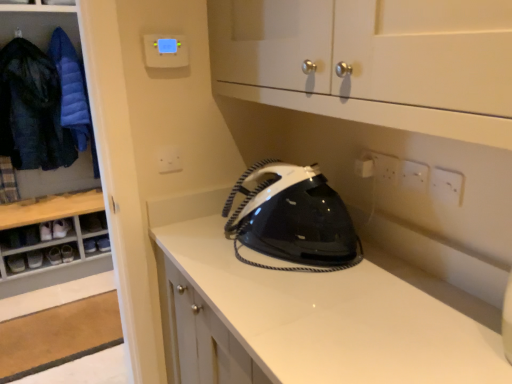
In order to face white plastic electric outlet at center, which is counted as the 3th electric outlet, starting from the right, should I rotate leftwards or rightwards?

To align with it, rotate left about 11.544°.

Image resolution: width=512 pixels, height=384 pixels. I want to click on white plastic electric outlet at center, which is counted as the 3th electric outlet, starting from the right, so click(x=169, y=159).

What do you see at coordinates (293, 219) in the screenshot?
I see `black glossy iron at center` at bounding box center [293, 219].

You are a GUI agent. You are given a task and a screenshot of the screen. Output one action in this format:
    pyautogui.click(x=<x>, y=<y>)
    Task: Click on the white fabric shoe at lower left, the 1th footwear when ordered from top to bottom
    Image resolution: width=512 pixels, height=384 pixels.
    Given the screenshot: What is the action you would take?
    pyautogui.click(x=60, y=228)

Is white plastic electric outlet at upper right, the 2th electric outlet viewed from the left, taller or shorter than white leather shoe at lower left, the 4th footwear in the top-to-bottom sequence?

Considering their sizes, white plastic electric outlet at upper right, the 2th electric outlet viewed from the left, has more height than white leather shoe at lower left, the 4th footwear in the top-to-bottom sequence.

Does white plastic electric outlet at upper right, the second electric outlet viewed from the front, come in front of white leather shoe at lower left, the 4th footwear in the top-to-bottom sequence?

Yes, the depth of white plastic electric outlet at upper right, the second electric outlet viewed from the front, is less than that of white leather shoe at lower left, the 4th footwear in the top-to-bottom sequence.

Looking at this image, can you confirm if white plastic electric outlet at upper right, which is counted as the second electric outlet, starting from the back, is positioned to the left of white leather shoe at lower left, the 4th footwear in the top-to-bottom sequence?

No.

Identify the location of the 4th footwear to the left of the white plastic electric outlet at center, the first electric outlet from the left, starting your count from the anchor. The image size is (512, 384). (34, 259).

Could you tell me if white leather shoe at lower left, the 4th footwear in the top-to-bottom sequence, is turned towards white plastic electric outlet at center, which is counted as the 1th electric outlet, starting from the back?

No, white leather shoe at lower left, the 4th footwear in the top-to-bottom sequence, is not facing towards white plastic electric outlet at center, which is counted as the 1th electric outlet, starting from the back.

Can you confirm if white leather shoe at lower left, arranged as the 2th footwear when ordered from the bottom, is positioned to the right of white plastic electric outlet at center, placed as the third electric outlet when sorted from front to back?

In fact, white leather shoe at lower left, arranged as the 2th footwear when ordered from the bottom, is to the left of white plastic electric outlet at center, placed as the third electric outlet when sorted from front to back.

Is white leather shoe at lower left, arranged as the 2th footwear when ordered from the bottom, positioned behind white plastic electric outlet at center, placed as the third electric outlet when sorted from front to back?

Yes.

How different are the orientations of black glossy iron at center and dark blue quilted jacket at left, the 2th clothing from the right, in degrees?

They differ by 90.8 degrees in their facing directions.

Looking at the image, does black glossy iron at center seem bigger or smaller compared to dark blue quilted jacket at left, the 2th clothing from the right?

black glossy iron at center is smaller than dark blue quilted jacket at left, the 2th clothing from the right.

From a real-world perspective, who is located higher, black glossy iron at center or dark blue quilted jacket at left, the first clothing in the left-to-right sequence?

dark blue quilted jacket at left, the first clothing in the left-to-right sequence, is physically above.

Does black glossy iron at center appear on the right side of dark blue quilted jacket at left, the first clothing in the left-to-right sequence?

Yes, black glossy iron at center is to the right of dark blue quilted jacket at left, the first clothing in the left-to-right sequence.

Is white plastic electric outlet at upper right, which is the second electric outlet from right to left, smaller than blue down jacket at left, which appears as the first clothing when viewed from the right?

Indeed, white plastic electric outlet at upper right, which is the second electric outlet from right to left, has a smaller size compared to blue down jacket at left, which appears as the first clothing when viewed from the right.

From the image's perspective, is white plastic electric outlet at upper right, the 2th electric outlet viewed from the left, beneath blue down jacket at left, which appears as the first clothing when viewed from the right?

Yes.

Who is more distant, white plastic electric outlet at upper right, the second electric outlet viewed from the front, or blue down jacket at left, positioned as the second clothing in left-to-right order?

blue down jacket at left, positioned as the second clothing in left-to-right order, is further from the camera.

From the image's perspective, would you say black leather shoe at lower left, the 1th footwear ordered from the bottom, is shown under dark blue quilted jacket at left, the 2th clothing from the right?

Indeed, from the image's perspective, black leather shoe at lower left, the 1th footwear ordered from the bottom, is shown beneath dark blue quilted jacket at left, the 2th clothing from the right.

From a real-world perspective, between black leather shoe at lower left, the 1th footwear ordered from the bottom, and dark blue quilted jacket at left, the 2th clothing from the right, who is vertically lower?

In real-world perspective, black leather shoe at lower left, the 1th footwear ordered from the bottom, is lower.

Considering the positions of point (22, 269) and point (29, 79), is point (22, 269) closer or farther from the camera than point (29, 79)?

Clearly, point (22, 269) is more distant from the camera than point (29, 79).

Are black leather shoe at lower left, the 1th footwear ordered from the bottom, and dark blue quilted jacket at left, the first clothing in the left-to-right sequence, located far from each other?

No, black leather shoe at lower left, the 1th footwear ordered from the bottom, is in close proximity to dark blue quilted jacket at left, the first clothing in the left-to-right sequence.

How far apart are black leather shoe at lower left, the 1th footwear ordered from the bottom, and black leather shoe at lower left, marked as the 3th footwear in a bottom-to-top arrangement?

A distance of 17.98 centimeters exists between black leather shoe at lower left, the 1th footwear ordered from the bottom, and black leather shoe at lower left, marked as the 3th footwear in a bottom-to-top arrangement.

There is a black leather shoe at lower left, marked as the 3th footwear in a bottom-to-top arrangement. Where is `the 2nd footwear below it (from a real-world perspective)`? The image size is (512, 384). the 2nd footwear below it (from a real-world perspective) is located at coordinates (16, 263).

How different are the orientations of black leather shoe at lower left, the 1th footwear ordered from the bottom, and black leather shoe at lower left, marked as the 3th footwear in a bottom-to-top arrangement, in degrees?

0.000269 degrees.

Is point (17, 264) closer to viewer compared to point (60, 259)?

Yes, it is.

Is point (58, 237) in front of point (24, 107)?

No, it is behind (24, 107).

Is white fabric shoe at lower left, the 1th footwear when ordered from top to bottom, with dark blue quilted jacket at left, the 2th clothing from the right?

No, white fabric shoe at lower left, the 1th footwear when ordered from top to bottom, is not making contact with dark blue quilted jacket at left, the 2th clothing from the right.

From a real-world perspective, which object rests below the other?

In real-world perspective, white fabric shoe at lower left, which is the 5th footwear in bottom-to-top order, is lower.

From the image's perspective, between white fabric shoe at lower left, the 1th footwear when ordered from top to bottom, and dark blue quilted jacket at left, the first clothing in the left-to-right sequence, which one is located above?

dark blue quilted jacket at left, the first clothing in the left-to-right sequence.

Identify the location of the 2nd electric outlet above the white leather shoe at lower left, the 4th footwear in the top-to-bottom sequence (from the image's perspective). (413, 176).

The height and width of the screenshot is (384, 512). Identify the location of the 4th footwear behind the white plastic electric outlet at center, placed as the third electric outlet when sorted from front to back, starting your count from the anchor. (34, 259).

When comparing their distances from white fabric shoe at lower left, the 1th footwear when ordered from top to bottom, does dark blue quilted jacket at left, the 2th clothing from the right, or white plastic electric outlet at center right, which is counted as the 1th electric outlet, starting from the right, seem closer?

Based on the image, dark blue quilted jacket at left, the 2th clothing from the right, appears to be nearer to white fabric shoe at lower left, the 1th footwear when ordered from top to bottom.

Which object lies further to the anchor point black glossy iron at center, white fabric shoe at lower left, which is the 5th footwear in bottom-to-top order, or dark blue quilted jacket at left, the first clothing in the left-to-right sequence?

white fabric shoe at lower left, which is the 5th footwear in bottom-to-top order.

When comparing their distances from black leather shoe at lower left, the 5th footwear positioned from the top, does blue down jacket at left, which appears as the first clothing when viewed from the right, or white plastic electric outlet at upper right, which is the second electric outlet from right to left, seem closer?

Based on the image, blue down jacket at left, which appears as the first clothing when viewed from the right, appears to be nearer to black leather shoe at lower left, the 5th footwear positioned from the top.

Estimate the real-world distances between objects in this image. Which object is further from white plastic electric outlet at upper right, the 2th electric outlet viewed from the left, white leather shoe at lower left, placed as the fourth footwear when sorted from bottom to top, or wooden dresser at left?

Among the two, white leather shoe at lower left, placed as the fourth footwear when sorted from bottom to top, is located further to white plastic electric outlet at upper right, the 2th electric outlet viewed from the left.

Estimate the real-world distances between objects in this image. Which object is closer to blue down jacket at left, positioned as the second clothing in left-to-right order, black leather shoe at lower left, the 1th footwear ordered from the bottom, or wooden dresser at left?

wooden dresser at left lies closer to blue down jacket at left, positioned as the second clothing in left-to-right order, than the other object.

Based on their spatial positions, is white leather shoe at lower left, arranged as the 2th footwear when ordered from the bottom, or white leather shoe at lower left, placed as the fourth footwear when sorted from bottom to top, closer to white plastic electric outlet at upper right, which is counted as the second electric outlet, starting from the back?

Among the two, white leather shoe at lower left, placed as the fourth footwear when sorted from bottom to top, is located nearer to white plastic electric outlet at upper right, which is counted as the second electric outlet, starting from the back.

Considering their positions, is white plastic electric outlet at center right, which is the 3th electric outlet from left to right, positioned closer to white leather shoe at lower left, arranged as the 2th footwear when ordered from the bottom, than wooden dresser at left?

wooden dresser at left is closer to white leather shoe at lower left, arranged as the 2th footwear when ordered from the bottom.

Based on their spatial positions, is black glossy iron at center or white plastic electric outlet at upper right, which is counted as the second electric outlet, starting from the back, further from black leather shoe at lower left, which is counted as the third footwear, starting from the top?

Based on the image, white plastic electric outlet at upper right, which is counted as the second electric outlet, starting from the back, appears to be further to black leather shoe at lower left, which is counted as the third footwear, starting from the top.

Where is `dresser between black leather shoe at lower left, the 5th footwear positioned from the top, and black glossy iron at center from left to right`? dresser between black leather shoe at lower left, the 5th footwear positioned from the top, and black glossy iron at center from left to right is located at coordinates (38, 23).

Identify the location of footwear between white fabric shoe at lower left, which is the 5th footwear in bottom-to-top order, and black leather shoe at lower left, marked as the 3th footwear in a bottom-to-top arrangement, from top to bottom. (46, 231).

You are a GUI agent. You are given a task and a screenshot of the screen. Output one action in this format:
    pyautogui.click(x=<x>, y=<y>)
    Task: Click on the dresser between white leather shoe at lower left, arranged as the 2th footwear when ordered from the bottom, and white plastic electric outlet at upper right, the 2th electric outlet viewed from the left
    This screenshot has width=512, height=384.
    Given the screenshot: What is the action you would take?
    pyautogui.click(x=38, y=23)

What are the coordinates of `electric outlet between white plastic electric outlet at center, the first electric outlet from the left, and white plastic electric outlet at center right, which is counted as the 1th electric outlet, starting from the right, from left to right` in the screenshot? It's located at (413, 176).